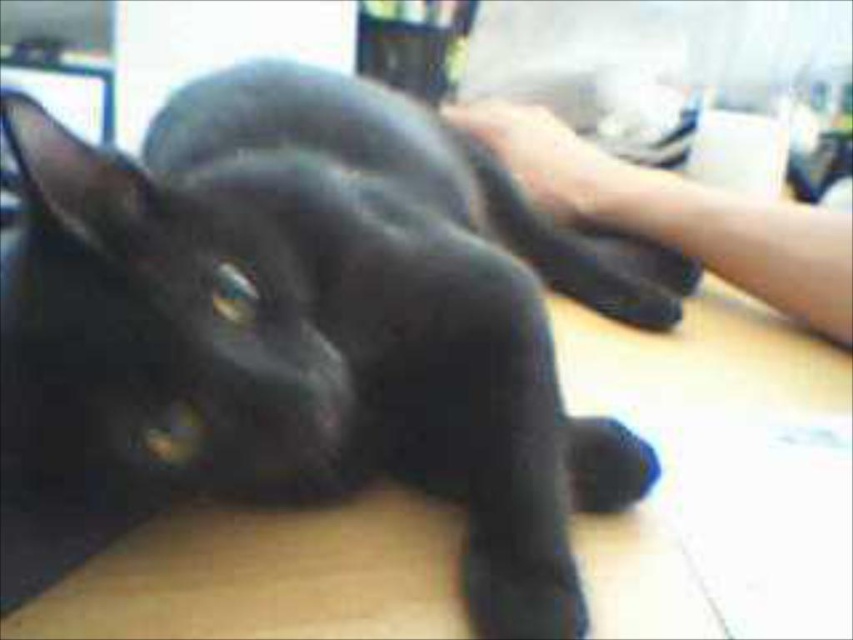
Question: Which point is farther from the camera taking this photo?

Choices:
 (A) (91, 320)
 (B) (581, 212)

Answer: (B)

Question: Which object is the closest to the black matte paw at center?

Choices:
 (A) shiny black cat at center
 (B) skinny white arm at upper right

Answer: (B)

Question: Can you confirm if shiny black cat at center is smaller than black matte paw at center?

Choices:
 (A) yes
 (B) no

Answer: (B)

Question: Is shiny black cat at center thinner than black matte paw at center?

Choices:
 (A) no
 (B) yes

Answer: (A)

Question: Does shiny black cat at center have a greater width compared to skinny white arm at upper right?

Choices:
 (A) no
 (B) yes

Answer: (B)

Question: Which point is farther to the camera?

Choices:
 (A) shiny black cat at center
 (B) black matte paw at center

Answer: (B)